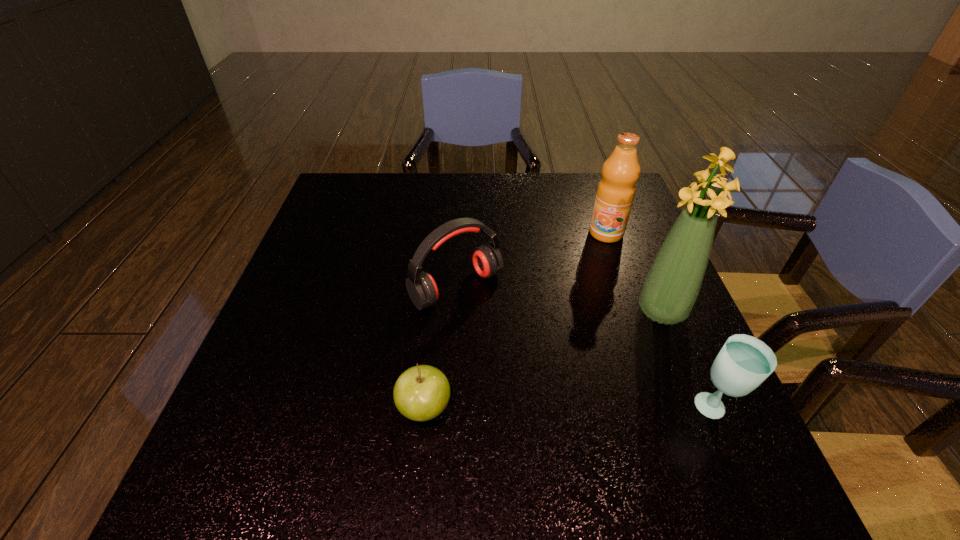
Identify the location of free space that is in between the earphone and the bouquet. Image resolution: width=960 pixels, height=540 pixels. (559, 299).

In order to click on vacant space that's between the shortest object and the fourth shortest object in this screenshot , I will do `click(516, 321)`.

What are the coordinates of `free space that is in between the fourth shortest object and the earphone` in the screenshot? It's located at (531, 260).

Where is `free area in between the farthest object and the earphone`? The width and height of the screenshot is (960, 540). free area in between the farthest object and the earphone is located at coordinates (531, 260).

This screenshot has width=960, height=540. In order to click on free space that is in between the farthest object and the earphone in this screenshot , I will do `click(531, 260)`.

The height and width of the screenshot is (540, 960). In order to click on empty location between the shortest object and the earphone in this screenshot , I will do click(441, 348).

Select which object appears as the second closest to the glass. Please provide its 2D coordinates. Your answer should be formatted as a tuple, i.e. [(x, y)], where the tuple contains the x and y coordinates of a point satisfying the conditions above.

[(487, 260)]

You are a GUI agent. You are given a task and a screenshot of the screen. Output one action in this format:
    pyautogui.click(x=<x>, y=<y>)
    Task: Click on the second closest object to the fourth shortest object
    
    Given the screenshot: What is the action you would take?
    pyautogui.click(x=487, y=260)

The image size is (960, 540). Find the location of `vacant region that satisfies the following two spatial constraints: 1. on the back side of the apple; 2. on the right side of the earphone`. vacant region that satisfies the following two spatial constraints: 1. on the back side of the apple; 2. on the right side of the earphone is located at coordinates (437, 288).

Locate an element on the screen. This screenshot has height=540, width=960. vacant region that satisfies the following two spatial constraints: 1. on the front side of the glass; 2. on the right side of the earphone is located at coordinates (449, 409).